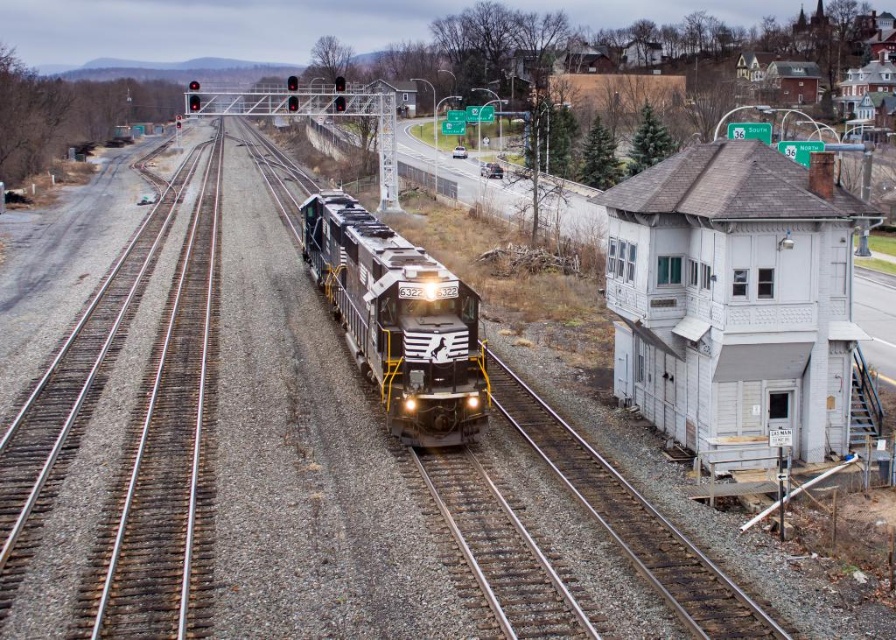
Which is more to the left, black textured locomotive at center or brick building at upper right?

From the viewer's perspective, black textured locomotive at center appears more on the left side.

Between black textured locomotive at center and brick building at upper right, which one is positioned higher?

Positioned higher is brick building at upper right.

Identify the location of black textured locomotive at center. The width and height of the screenshot is (896, 640). (399, 321).

Between smooth steel tracks at center and brick building at upper right, which one is positioned higher?

brick building at upper right

How far apart are smooth steel tracks at center and brick building at upper right?

They are 131.05 meters apart.

Which is behind, point (97, 476) or point (625, 104)?

Positioned behind is point (625, 104).

Find the location of `smooth steel tracks at center`. smooth steel tracks at center is located at coordinates (289, 458).

Measure the distance between point (242,141) and camera.

Point (242,141) is 184.33 meters from camera.

Who is taller, smooth steel tracks at center or black textured locomotive at center?

With more height is smooth steel tracks at center.

You are a GUI agent. You are given a task and a screenshot of the screen. Output one action in this format:
    pyautogui.click(x=<x>, y=<y>)
    Task: Click on the smooth steel tracks at center
    The height and width of the screenshot is (640, 896).
    Given the screenshot: What is the action you would take?
    pyautogui.click(x=289, y=458)

The height and width of the screenshot is (640, 896). Identify the location of smooth steel tracks at center. (289, 458).